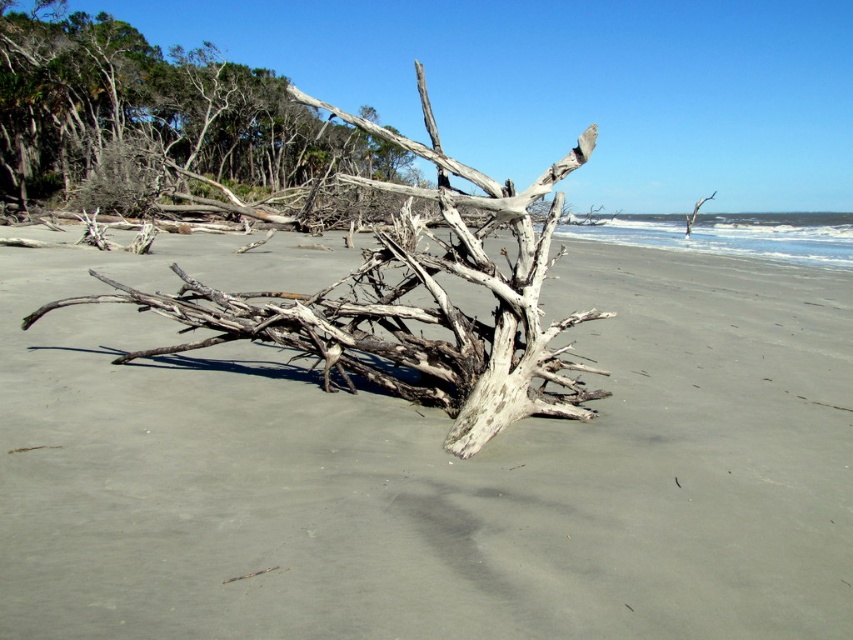
In order to click on gray sand at center in this screenshot , I will do `click(428, 467)`.

Which of these two, gray sand at center or gray bark tree at upper left, stands taller?

Standing taller between the two is gray bark tree at upper left.

Where is `gray sand at center`? gray sand at center is located at coordinates (428, 467).